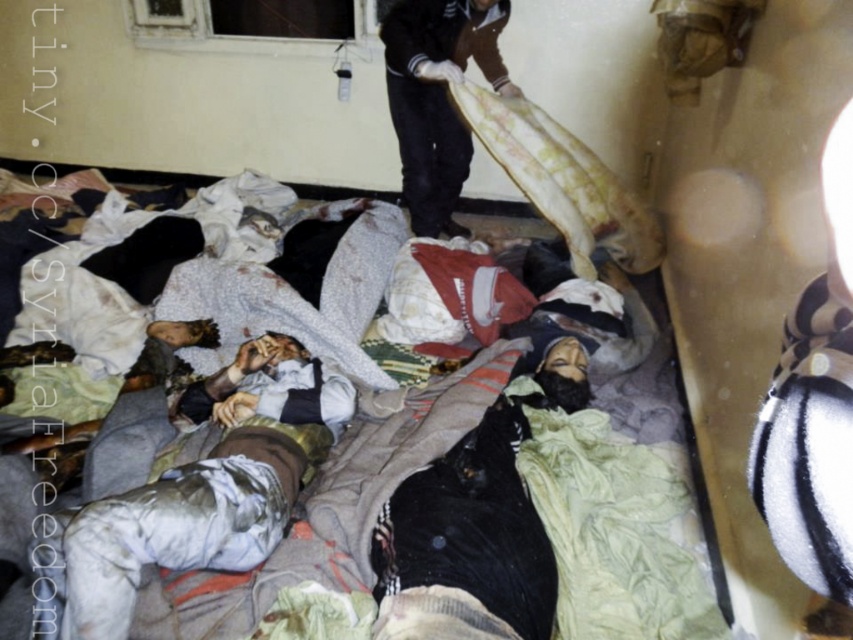
Based on the scene described, which object is positioned to the left of the other between the white cotton blanket at center and the brown cotton shirt at upper center?

The white cotton blanket at center is positioned to the left of the brown cotton shirt at upper center.